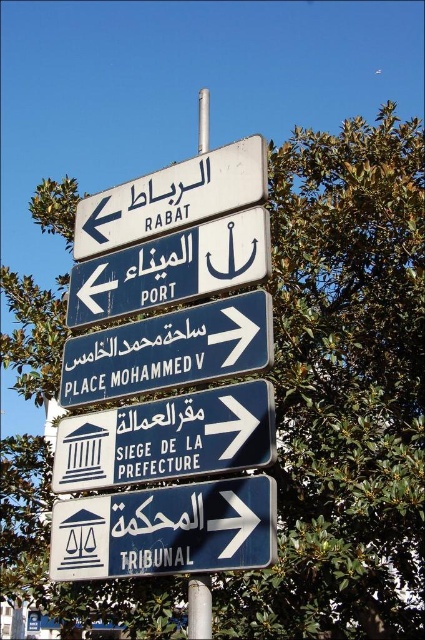
Question: Where is blue metallic sign at center located in relation to white plastic sign at upper center in the image?

Choices:
 (A) below
 (B) above

Answer: (A)

Question: Does blue metallic sign at center-right appear over white plastic pole at center?

Choices:
 (A) no
 (B) yes

Answer: (B)

Question: Does blue metallic sign at center-right appear under white plastic sign at upper center?

Choices:
 (A) yes
 (B) no

Answer: (A)

Question: Which point appears closest to the camera in this image?

Choices:
 (A) (204, 573)
 (B) (269, 332)

Answer: (A)

Question: Which of the following is the farthest from the observer?

Choices:
 (A) white plastic sign at left
 (B) blue metallic sign at center-right

Answer: (A)

Question: Among these points, which one is farthest from the camera?

Choices:
 (A) (221, 273)
 (B) (91, 456)

Answer: (B)